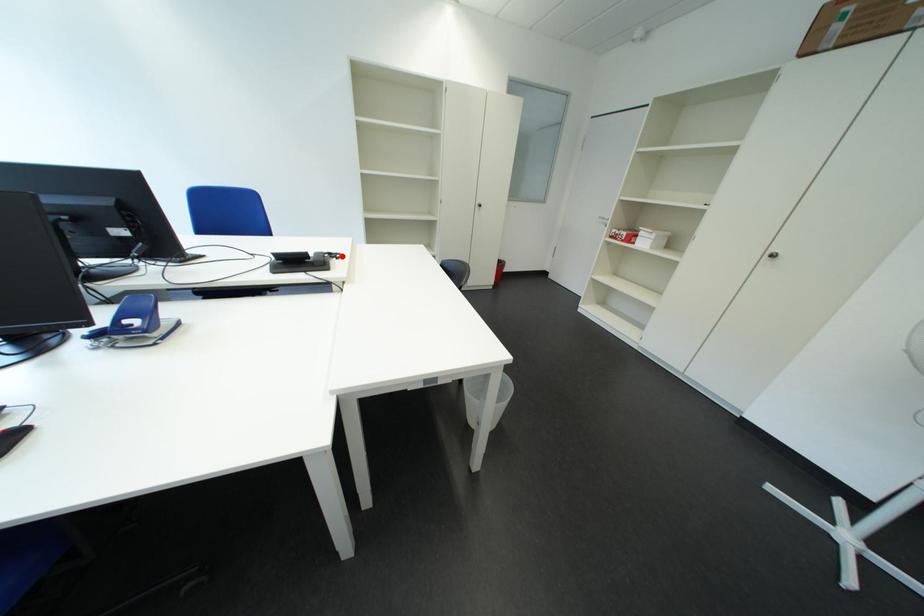
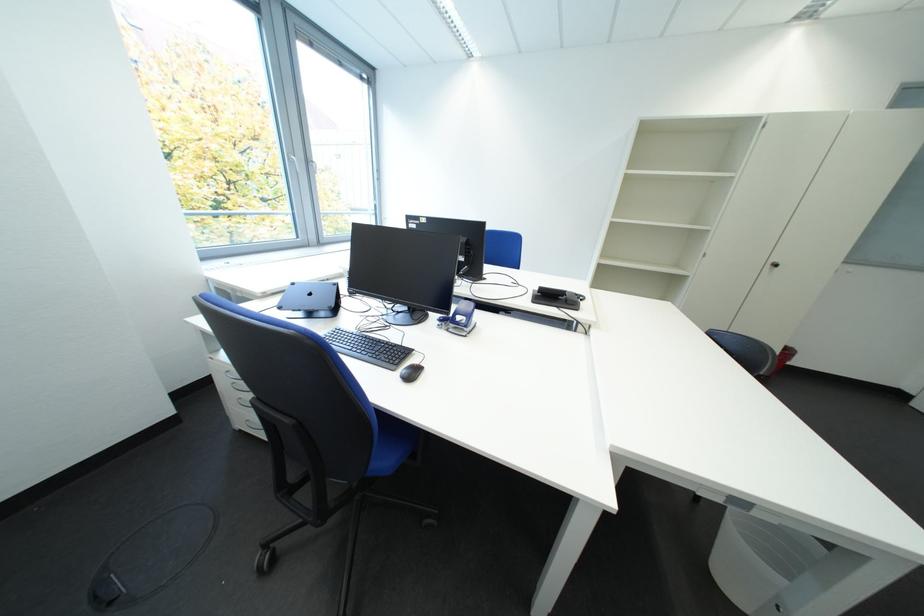
In the second image, find the point that corresponds to the highlighted location in the first image.

(586, 297)